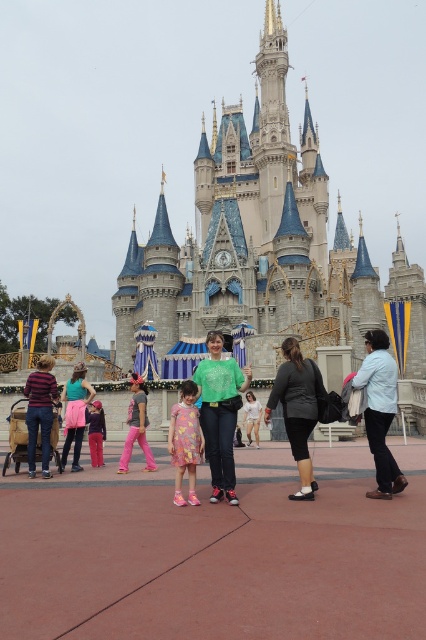
What is located at the point with coordinates (184, 442) in the image?

The point with coordinates (184, 442) is located on the dusty pink dress at center.

You are a photographer at the theme park and need to position two dresses for a photo shoot. The dusty pink dress at center and the matte pink dress at center must be arranged so that one is visible above the other. Which dress should be placed higher to ensure visibility?

The dusty pink dress at center should be placed higher since it is located above the matte pink dress at center, ensuring it remains visible.

Looking at this image, you are a photographer trying to capture a photo of the light blue denim jacket at lower right and the pink fabric pants at center. Which object is positioned to the right side of the other?

The light blue denim jacket at lower right is to the right of the pink fabric pants at center according to the description.